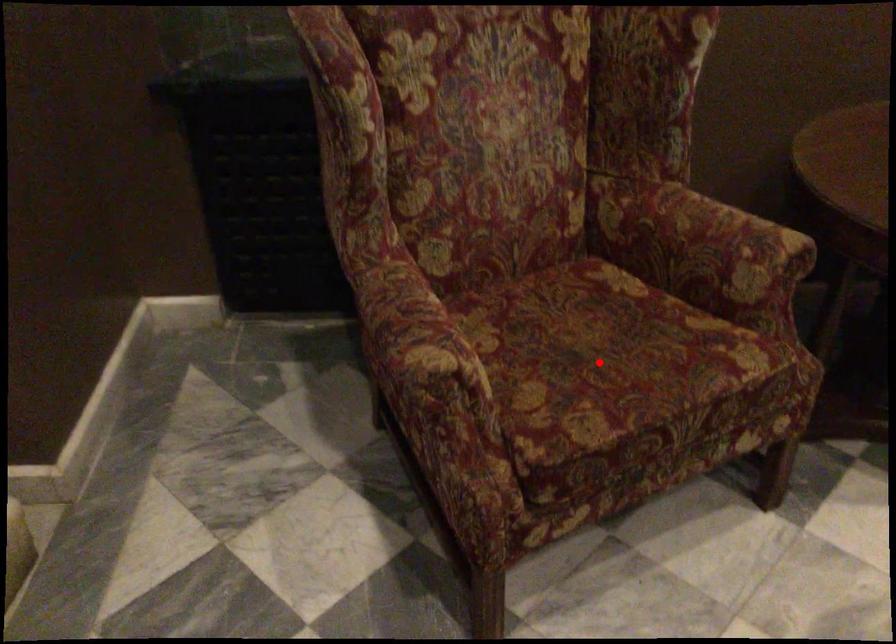
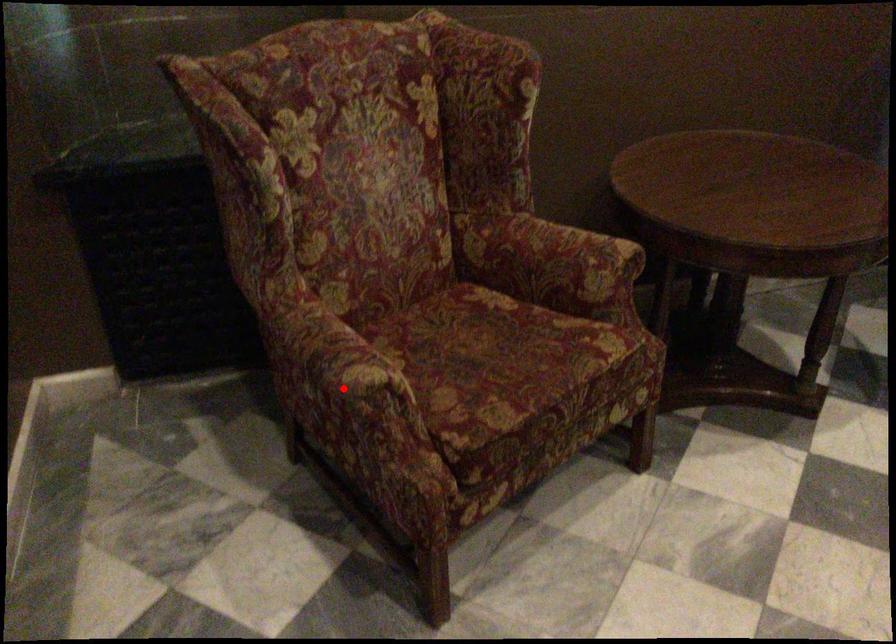
I am providing you with two images of the same scene from different viewpoints. A red point is marked on the first image and another point is marked on the second image. Are the points marked in image1 and image2 representing the same 3D position?

No